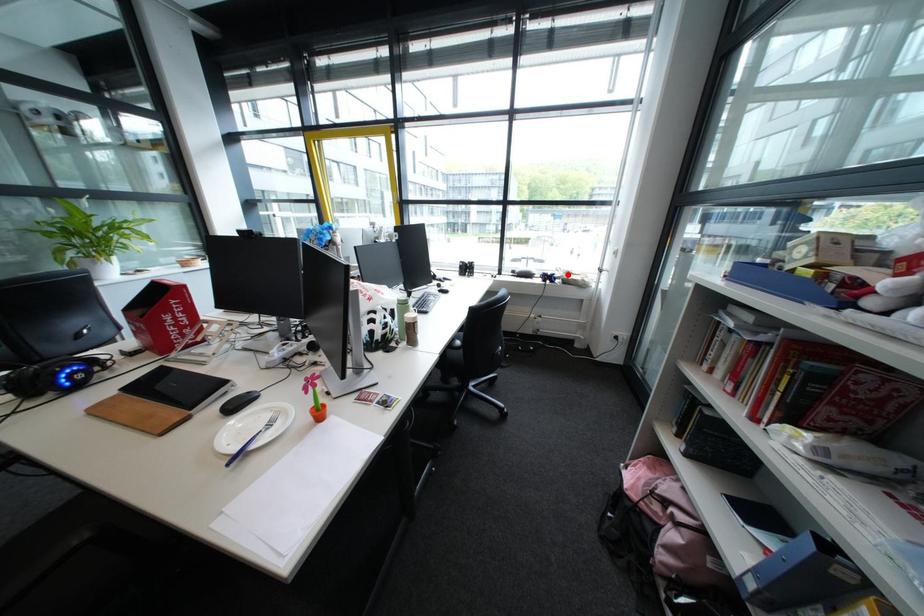
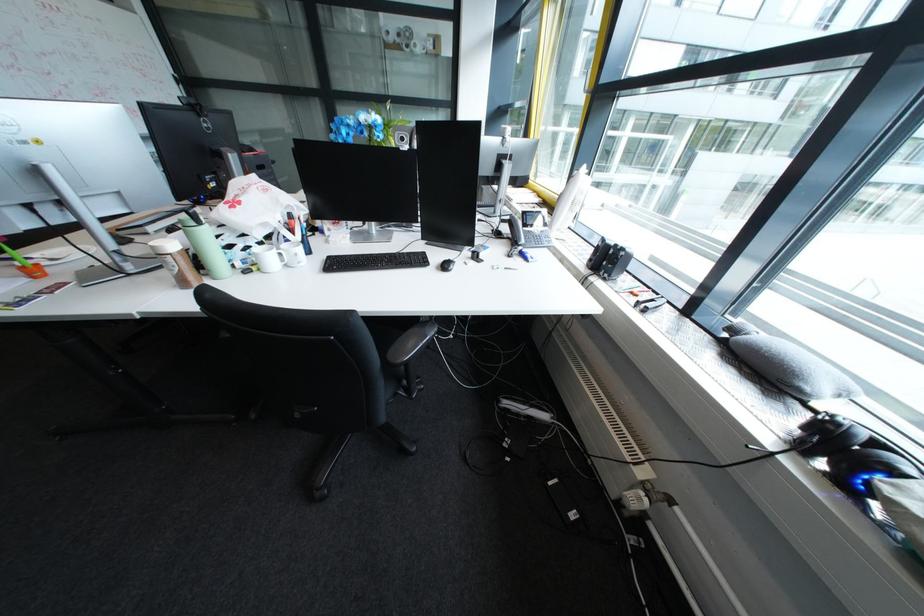
Question: A red point is marked in image1. In image2, is the corresponding 3D point closer to the camera or farther? Reply with the corresponding letter.

Choices:
 (A) The corresponding 3D point is closer.
 (B) The corresponding 3D point is farther.

Answer: (B)